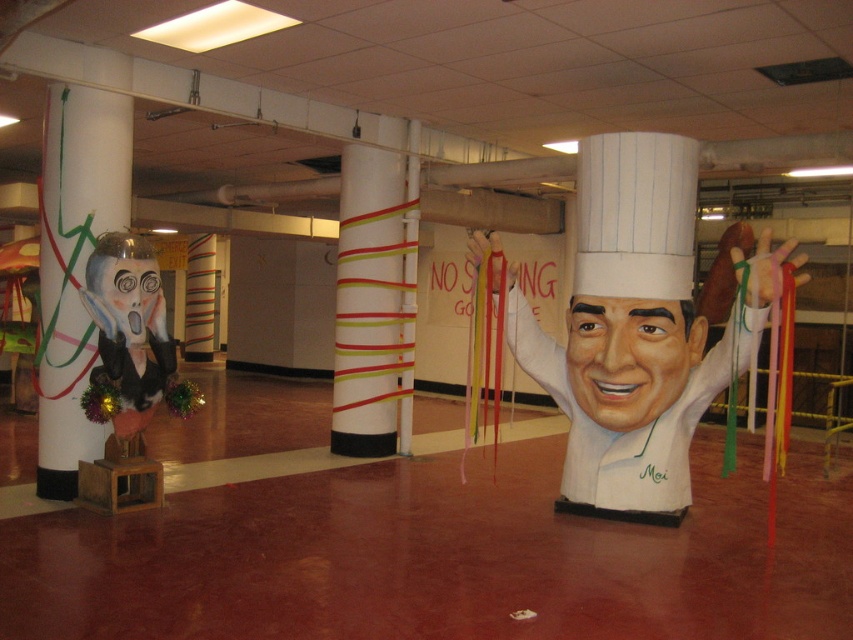
You are an interior designer assessing the space. You need to place a decorative item that requires a surface wider than the matte black face at left. Can the white glossy pillar at left provide enough space?

The white glossy pillar at left is wider than the matte black face at left, so it can accommodate the decorative item requiring a wider surface.

You are standing in the parking garage and see two points marked on the floor. The first point is at coordinates point [509,292] and the second is at point [453,292]. Which point is closer to you?

Point [509,292] is in front of point [453,292], so it is closer to you.